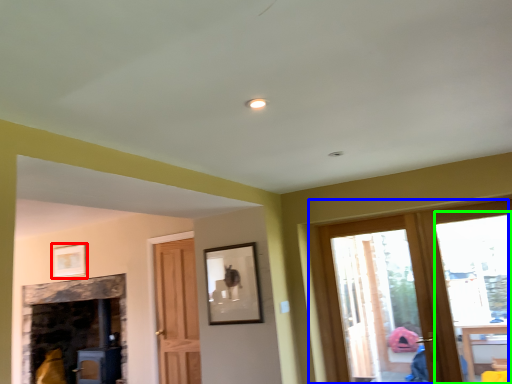
Question: Considering the real-world distances, which object is farthest from picture frame (highlighted by a red box)? window (highlighted by a blue box) or window (highlighted by a green box)?

Choices:
 (A) window
 (B) window

Answer: (B)